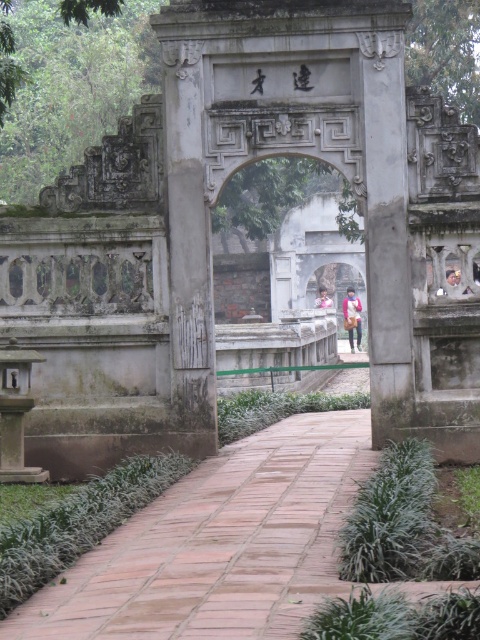
Is point (175, 600) behind point (350, 314)?

No, (175, 600) is in front of (350, 314).

Is the position of brown brick path at center less distant than that of matte brown jacket at center?

Yes, brown brick path at center is in front of matte brown jacket at center.

Image resolution: width=480 pixels, height=640 pixels. Find the location of `brown brick path at center`. brown brick path at center is located at coordinates (219, 545).

Where is `brown brick path at center`? This screenshot has height=640, width=480. brown brick path at center is located at coordinates (219, 545).

Can you confirm if brown brick path at center is positioned below smooth stone lantern at left?

Indeed, brown brick path at center is positioned under smooth stone lantern at left.

Can you confirm if brown brick path at center is positioned above smooth stone lantern at left?

Actually, brown brick path at center is below smooth stone lantern at left.

Which is in front, point (356, 433) or point (8, 400)?

Point (8, 400) is in front.

Identify the location of brown brick path at center. The image size is (480, 640). (219, 545).

Which is below, matte brown jacket at center or pink fabric at center?

Positioned lower is matte brown jacket at center.

Consider the image. Is matte brown jacket at center positioned before pink fabric at center?

Yes, matte brown jacket at center is in front of pink fabric at center.

Find the location of `matte brown jacket at center`. matte brown jacket at center is located at coordinates (351, 316).

The height and width of the screenshot is (640, 480). I want to click on matte brown jacket at center, so click(351, 316).